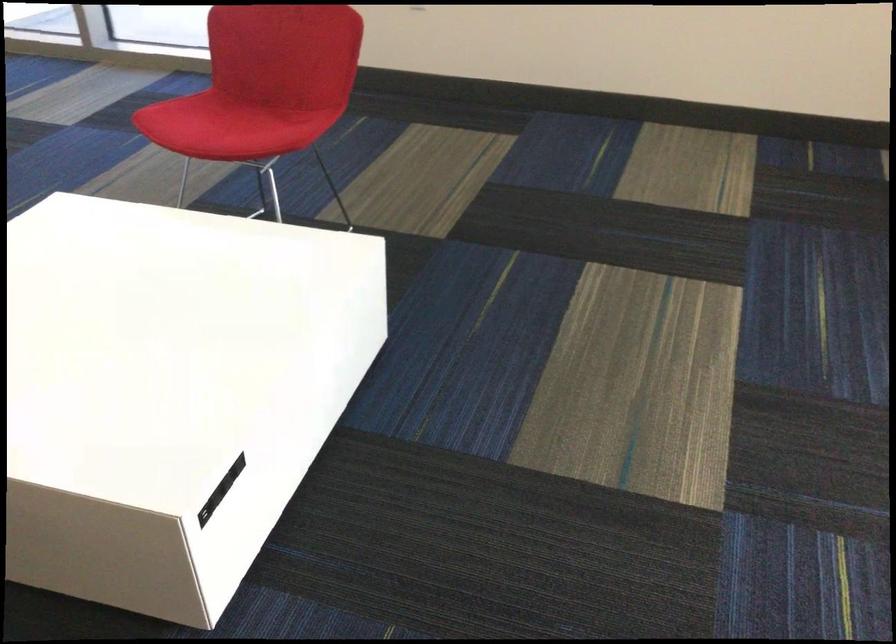
What do you see at coordinates (225, 124) in the screenshot?
I see `a chair sitting surface` at bounding box center [225, 124].